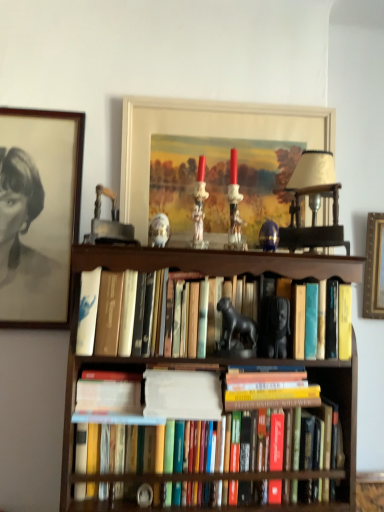
Where is `brown wooden bookcase at center`? This screenshot has height=512, width=384. brown wooden bookcase at center is located at coordinates [x=187, y=273].

Where is `matte black portrait at upper left, placed as the 1th picture frame when sorted from left to right`? Image resolution: width=384 pixels, height=512 pixels. matte black portrait at upper left, placed as the 1th picture frame when sorted from left to right is located at coordinates point(38,214).

This screenshot has height=512, width=384. What are the coordinates of `white paper at center, which is the 2th book in top-to-bottom order` in the screenshot? It's located at click(182, 395).

Find the location of `hardcover books at center, positioned as the second book in bottom-to-top order`. hardcover books at center, positioned as the second book in bottom-to-top order is located at coordinates (269, 390).

This screenshot has height=512, width=384. Describe the element at coordinates (313, 203) in the screenshot. I see `matte beige lampshade at upper center` at that location.

Find the location of `hardcover books at center, the first book in the bottom-to-top sequence`. hardcover books at center, the first book in the bottom-to-top sequence is located at coordinates (222, 477).

How many degrees apart are the facing directions of hardcover books at center, the first book in the bottom-to-top sequence, and matte white picture frame at upper center, the second picture frame when ordered from left to right?

2.14 degrees.

Which point is more distant from viewer, (336, 394) or (285, 122)?

The point (285, 122) is farther from the camera.

Looking at this image, are hardcover books at center, which is the 4th book in top-to-bottom order, and matte white picture frame at upper center, the first picture frame positioned from the right, far apart?

Actually, hardcover books at center, which is the 4th book in top-to-bottom order, and matte white picture frame at upper center, the first picture frame positioned from the right, are a little close together.

How distant is hardcover books at center, which is counted as the 4th book, starting from the bottom, from brown wooden bookcase at center?

hardcover books at center, which is counted as the 4th book, starting from the bottom, is 3.40 inches from brown wooden bookcase at center.

Which is more distant, (160, 310) or (181, 269)?

The point (181, 269) is behind.

Is hardcover books at center, which is counted as the 4th book, starting from the bottom, at the right side of brown wooden bookcase at center?

No, hardcover books at center, which is counted as the 4th book, starting from the bottom, is not to the right of brown wooden bookcase at center.

Who is taller, hardcover books at center, which is counted as the 4th book, starting from the bottom, or brown wooden bookcase at center?

With more height is brown wooden bookcase at center.

Is matte black portrait at upper left, the 2th picture frame in the right-to-left sequence, oriented away from white paper at center, the 3th book when ordered from bottom to top?

matte black portrait at upper left, the 2th picture frame in the right-to-left sequence, is not turned away from white paper at center, the 3th book when ordered from bottom to top.

Is the surface of matte black portrait at upper left, placed as the 1th picture frame when sorted from left to right, in direct contact with white paper at center, the 3th book when ordered from bottom to top?

No, matte black portrait at upper left, placed as the 1th picture frame when sorted from left to right, is not making contact with white paper at center, the 3th book when ordered from bottom to top.

Is matte black portrait at upper left, placed as the 1th picture frame when sorted from left to right, in front of or behind white paper at center, which is the 2th book in top-to-bottom order, in the image?

In the image, matte black portrait at upper left, placed as the 1th picture frame when sorted from left to right, appears behind white paper at center, which is the 2th book in top-to-bottom order.

Considering the relative positions of matte black portrait at upper left, placed as the 1th picture frame when sorted from left to right, and white paper at center, the 3th book when ordered from bottom to top, in the image provided, is matte black portrait at upper left, placed as the 1th picture frame when sorted from left to right, to the right of white paper at center, the 3th book when ordered from bottom to top, from the viewer's perspective?

Incorrect, matte black portrait at upper left, placed as the 1th picture frame when sorted from left to right, is not on the right side of white paper at center, the 3th book when ordered from bottom to top.

In terms of height, does matte white picture frame at upper center, the second picture frame when ordered from left to right, look taller or shorter compared to porcelain figurine at center, the second animal positioned from the bottom?

matte white picture frame at upper center, the second picture frame when ordered from left to right, is taller than porcelain figurine at center, the second animal positioned from the bottom.

Consider the image. Is matte white picture frame at upper center, the first picture frame positioned from the right, aimed at porcelain figurine at center, marked as the first animal in a top-to-bottom arrangement?

Yes, matte white picture frame at upper center, the first picture frame positioned from the right, faces towards porcelain figurine at center, marked as the first animal in a top-to-bottom arrangement.

From the image's perspective, which animal is the 1st one below the matte white picture frame at upper center, the second picture frame when ordered from left to right? Please provide its 2D coordinates.

[(159, 230)]

Is hardcover books at center, which is counted as the 4th book, starting from the bottom, positioned far away from matte beige lampshade at upper center?

No, hardcover books at center, which is counted as the 4th book, starting from the bottom, is not far away from matte beige lampshade at upper center.

Does hardcover books at center, arranged as the 1th book when viewed from the top, have a smaller size compared to matte beige lampshade at upper center?

No, hardcover books at center, arranged as the 1th book when viewed from the top, is not smaller than matte beige lampshade at upper center.

Is hardcover books at center, arranged as the 1th book when viewed from the top, outside of matte beige lampshade at upper center?

Yes, hardcover books at center, arranged as the 1th book when viewed from the top, is outside of matte beige lampshade at upper center.

Does hardcover books at center, arranged as the 1th book when viewed from the top, turn towards matte beige lampshade at upper center?

No, hardcover books at center, arranged as the 1th book when viewed from the top, is not turned towards matte beige lampshade at upper center.

From a real-world perspective, who is located lower, hardcover books at center, positioned as the second book in bottom-to-top order, or matte beige lampshade at upper center?

In real-world perspective, hardcover books at center, positioned as the second book in bottom-to-top order, is lower.

Is hardcover books at center, marked as the third book in a top-to-bottom arrangement, positioned beyond the bounds of matte beige lampshade at upper center?

Yes, hardcover books at center, marked as the third book in a top-to-bottom arrangement, is outside of matte beige lampshade at upper center.

You are a GUI agent. You are given a task and a screenshot of the screen. Output one action in this format:
    pyautogui.click(x=<x>, y=<y>)
    Task: Click on the 3rd book below the matte beige lampshade at upper center (from the image's perspective)
    This screenshot has width=384, height=512.
    Given the screenshot: What is the action you would take?
    pyautogui.click(x=269, y=390)

From the image's perspective, does porcelain figurine at center, the 1th animal from the left, appear lower than black glossy statue at center, marked as the 1th animal in a bottom-to-top arrangement?

Actually, porcelain figurine at center, the 1th animal from the left, appears above black glossy statue at center, marked as the 1th animal in a bottom-to-top arrangement, in the image.

Considering the sizes of objects porcelain figurine at center, which is the second animal from right to left, and black glossy statue at center, marked as the 1th animal in a bottom-to-top arrangement, in the image provided, who is smaller, porcelain figurine at center, which is the second animal from right to left, or black glossy statue at center, marked as the 1th animal in a bottom-to-top arrangement,?

porcelain figurine at center, which is the second animal from right to left.

Considering the relative positions of porcelain figurine at center, marked as the first animal in a top-to-bottom arrangement, and black glossy statue at center, which ranks as the first animal in right-to-left order, in the image provided, is porcelain figurine at center, marked as the first animal in a top-to-bottom arrangement, to the right of black glossy statue at center, which ranks as the first animal in right-to-left order, from the viewer's perspective?

In fact, porcelain figurine at center, marked as the first animal in a top-to-bottom arrangement, is to the left of black glossy statue at center, which ranks as the first animal in right-to-left order.

Can you confirm if porcelain figurine at center, the second animal positioned from the bottom, is shorter than black glossy statue at center, which ranks as the first animal in right-to-left order?

Yes, porcelain figurine at center, the second animal positioned from the bottom, is shorter than black glossy statue at center, which ranks as the first animal in right-to-left order.

Image resolution: width=384 pixels, height=512 pixels. Identify the location of book that is the 2nd object to the left of the matte white picture frame at upper center, the second picture frame when ordered from left to right, starting at the anchor. (222, 477).

From the image's perspective, count 3rd books upward from the brown wooden bookcase at center and point to it. Please provide its 2D coordinates.

[(208, 318)]

When comparing their distances from hardcover books at center, the first book in the bottom-to-top sequence, does brown wooden bookcase at center or hardcover books at center, which is counted as the 4th book, starting from the bottom, seem further?

hardcover books at center, which is counted as the 4th book, starting from the bottom, lies further to hardcover books at center, the first book in the bottom-to-top sequence, than the other object.

In the scene shown: Which object lies nearer to the anchor point matte beige lampshade at upper center, hardcover books at center, marked as the third book in a top-to-bottom arrangement, or hardcover book at center?

Based on the image, hardcover books at center, marked as the third book in a top-to-bottom arrangement, appears to be nearer to matte beige lampshade at upper center.

Estimate the real-world distances between objects in this image. Which object is further from hardcover books at center, positioned as the second book in bottom-to-top order, hardcover books at center, which is the 4th book in top-to-bottom order, or porcelain figurine at center, marked as the first animal in a top-to-bottom arrangement?

Based on the image, porcelain figurine at center, marked as the first animal in a top-to-bottom arrangement, appears to be further to hardcover books at center, positioned as the second book in bottom-to-top order.

Based on their spatial positions, is matte white picture frame at upper center, the second picture frame when ordered from left to right, or brown wooden bookcase at center further from hardcover books at center, which is counted as the 4th book, starting from the bottom?

matte white picture frame at upper center, the second picture frame when ordered from left to right, is further to hardcover books at center, which is counted as the 4th book, starting from the bottom.

Which object lies nearer to the anchor point brown wooden bookcase at center, matte black portrait at upper left, placed as the 1th picture frame when sorted from left to right, or porcelain figurine at center, marked as the first animal in a top-to-bottom arrangement?

porcelain figurine at center, marked as the first animal in a top-to-bottom arrangement, is closer to brown wooden bookcase at center.

Looking at the image, which one is located further to white paper at center, the 3th book when ordered from bottom to top, matte black portrait at upper left, placed as the 1th picture frame when sorted from left to right, or hardcover books at center, positioned as the second book in bottom-to-top order?

Based on the image, matte black portrait at upper left, placed as the 1th picture frame when sorted from left to right, appears to be further to white paper at center, the 3th book when ordered from bottom to top.

When comparing their distances from matte black portrait at upper left, placed as the 1th picture frame when sorted from left to right, does matte beige lampshade at upper center or hardcover books at center, marked as the third book in a top-to-bottom arrangement, seem further?

Based on the image, hardcover books at center, marked as the third book in a top-to-bottom arrangement, appears to be further to matte black portrait at upper left, placed as the 1th picture frame when sorted from left to right.

Looking at the image, which one is located closer to black glossy statue at center, the 2th animal in the top-to-bottom sequence, hardcover books at center, arranged as the 1th book when viewed from the top, or white paper at center, which is the 2th book in top-to-bottom order?

hardcover books at center, arranged as the 1th book when viewed from the top.

At what (x,y) coordinates should I click in order to perform the action: click on animal between porcelain figurine at center, which is the second animal from right to left, and hardcover books at center, the first book in the bottom-to-top sequence, in the up-down direction. Please return your answer as a coordinate pair (x, y). This screenshot has height=512, width=384. Looking at the image, I should click on (236, 332).

Locate an element on the screen. This screenshot has width=384, height=512. paperback book between matte black portrait at upper left, the 2th picture frame in the right-to-left sequence, and hardcover books at center, marked as the third book in a top-to-bottom arrangement, in the horizontal direction is located at coordinates (109, 392).

You are a GUI agent. You are given a task and a screenshot of the screen. Output one action in this format:
    pyautogui.click(x=<x>, y=<y>)
    Task: Click on the animal between matte black portrait at upper left, the 2th picture frame in the right-to-left sequence, and black glossy statue at center, the second animal when ordered from left to right
    The image size is (384, 512).
    Given the screenshot: What is the action you would take?
    pyautogui.click(x=159, y=230)

This screenshot has height=512, width=384. I want to click on bookcase between matte black portrait at upper left, placed as the 1th picture frame when sorted from left to right, and hardcover books at center, which is the 4th book in top-to-bottom order, in the vertical direction, so click(x=187, y=273).